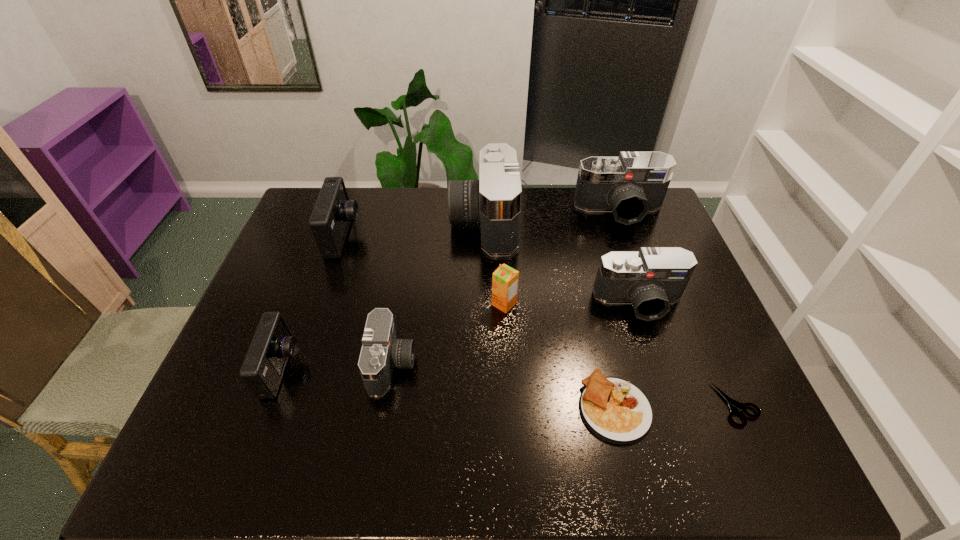
Find the location of a particular element. The height and width of the screenshot is (540, 960). free space at the near right corner is located at coordinates (706, 463).

Identify the location of unoccupied area between the smaller blue camera and the shears. click(x=510, y=387).

Identify the location of free space between the second shortest object and the third black camera from right to left. (549, 314).

The image size is (960, 540). In order to click on free space between the second nearest black camera and the farther blue camera in this screenshot , I will do `click(492, 269)`.

At what (x,y) coordinates should I click in order to perform the action: click on free space between the omelet and the leftmost black camera. Please return your answer as a coordinate pair (x, y). The image size is (960, 540). Looking at the image, I should click on (503, 386).

Locate an element on the screen. This screenshot has width=960, height=540. vacant space that is in between the second biggest black camera and the nearer blue camera is located at coordinates click(451, 290).

Identify the location of vacant area that lies between the omelet and the leftmost black camera. (503, 386).

Locate an element on the screen. Image resolution: width=960 pixels, height=540 pixels. vacant area that lies between the fourth camera from left to right and the third smallest black camera is located at coordinates (551, 216).

Locate an element on the screen. Image resolution: width=960 pixels, height=540 pixels. vacant space that is in between the farther blue camera and the third camera from left to right is located at coordinates (368, 300).

Find the location of a particular element. Image resolution: width=960 pixels, height=540 pixels. empty location between the shortest object and the smaller blue camera is located at coordinates (510, 387).